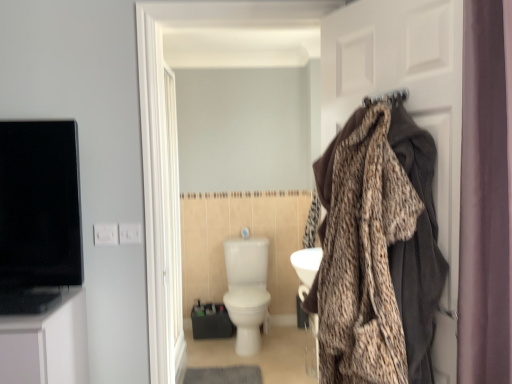
Question: Considering the relative sizes of leopard print blanket at right and purple fabric curtain at right in the image provided, is leopard print blanket at right taller than purple fabric curtain at right?

Choices:
 (A) no
 (B) yes

Answer: (A)

Question: From a real-world perspective, is leopard print blanket at right on top of purple fabric curtain at right?

Choices:
 (A) yes
 (B) no

Answer: (B)

Question: Considering the relative positions of leopard print blanket at right and purple fabric curtain at right in the image provided, is leopard print blanket at right to the left of purple fabric curtain at right from the viewer's perspective?

Choices:
 (A) yes
 (B) no

Answer: (A)

Question: From a real-world perspective, is leopard print blanket at right physically below purple fabric curtain at right?

Choices:
 (A) no
 (B) yes

Answer: (B)

Question: Is leopard print blanket at right bigger than purple fabric curtain at right?

Choices:
 (A) yes
 (B) no

Answer: (B)

Question: Is leopard print blanket at right far away from purple fabric curtain at right?

Choices:
 (A) yes
 (B) no

Answer: (B)

Question: Can we say white glossy toilet at center lies outside purple fabric curtain at right?

Choices:
 (A) no
 (B) yes

Answer: (B)

Question: From a real-world perspective, is white glossy toilet at center positioned under purple fabric curtain at right based on gravity?

Choices:
 (A) no
 (B) yes

Answer: (B)

Question: Is there a large distance between white glossy toilet at center and purple fabric curtain at right?

Choices:
 (A) no
 (B) yes

Answer: (B)

Question: Considering the relative sizes of white glossy toilet at center and purple fabric curtain at right in the image provided, is white glossy toilet at center wider than purple fabric curtain at right?

Choices:
 (A) yes
 (B) no

Answer: (A)

Question: Is white glossy toilet at center oriented away from purple fabric curtain at right?

Choices:
 (A) no
 (B) yes

Answer: (A)

Question: Is the position of white glossy toilet at center less distant than that of purple fabric curtain at right?

Choices:
 (A) yes
 (B) no

Answer: (B)

Question: From the image's perspective, is brown fabric coat at right below white glossy toilet at center?

Choices:
 (A) yes
 (B) no

Answer: (B)